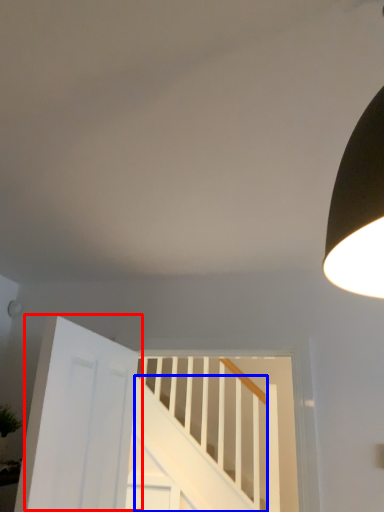
Question: Which point is further to the camera, door (highlighted by a red box) or stairs (highlighted by a blue box)?

Choices:
 (A) door
 (B) stairs

Answer: (B)